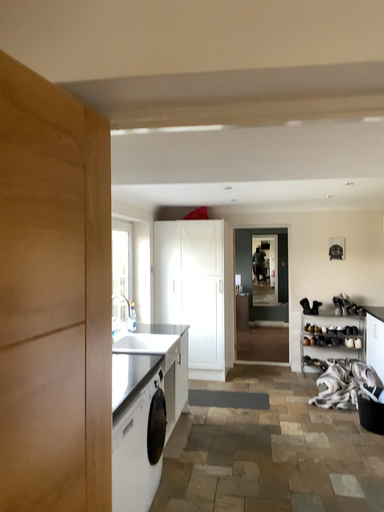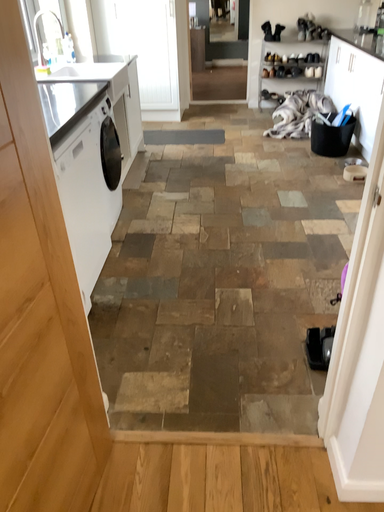
Question: How did the camera likely rotate when shooting the video?

Choices:
 (A) rotated downward
 (B) rotated upward

Answer: (A)